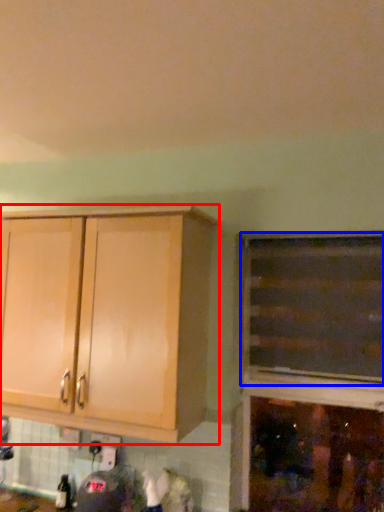
Question: Which of the following is the farthest to the observer, cabinetry (highlighted by a red box) or cabinetry (highlighted by a blue box)?

Choices:
 (A) cabinetry
 (B) cabinetry

Answer: (B)